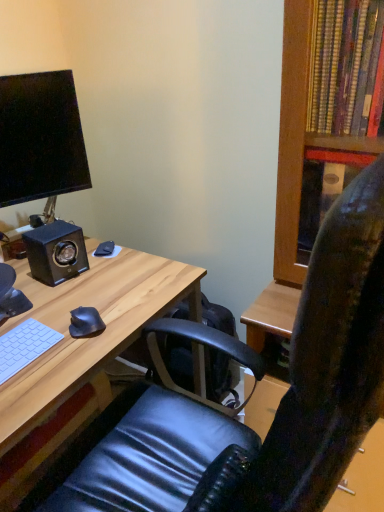
This screenshot has width=384, height=512. In order to click on free spot below white matte keyboard at lower left (from a real-world perspective) in this screenshot , I will do `click(15, 354)`.